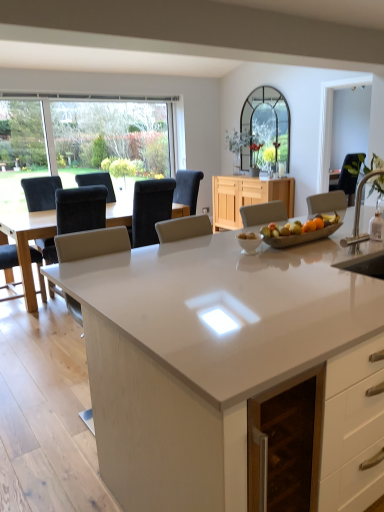
Question: Considering their positions, is light wood cabinet at center located in front of or behind white glossy countertop at center?

Choices:
 (A) behind
 (B) front

Answer: (A)

Question: Considering the positions of light wood cabinet at center and white glossy countertop at center in the image, is light wood cabinet at center bigger or smaller than white glossy countertop at center?

Choices:
 (A) small
 (B) big

Answer: (A)

Question: Which of these objects is positioned closest to the black fabric chair at right, which is the 1th chair from right to left?

Choices:
 (A) satin nickel faucet at right
 (B) black fabric chair at center, marked as the 3th chair in a left-to-right arrangement
 (C) transparent glass window at upper left
 (D) white glossy countertop at center
 (E) light wood cabinet at center

Answer: (E)

Question: Based on their relative distances, which object is nearer to the black fabric chair at center, marked as the 3th chair in a left-to-right arrangement?

Choices:
 (A) white glossy countertop at center
 (B) matte black chair at left, which is the first chair from left to right
 (C) matte black chair at left, the 2th chair when ordered from left to right
 (D) light wood cabinet at center
 (E) white glossy bowl at center

Answer: (C)